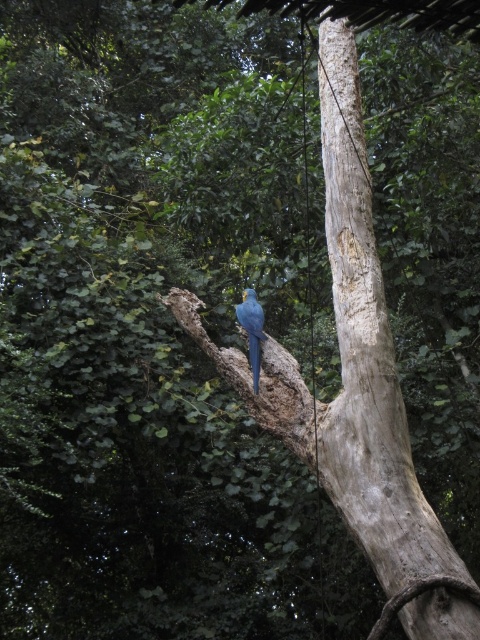
Question: Is smooth brown tree trunk at center further to camera compared to blue glossy parrot at center?

Choices:
 (A) no
 (B) yes

Answer: (A)

Question: Does smooth brown tree trunk at center lie behind blue glossy parrot at center?

Choices:
 (A) yes
 (B) no

Answer: (B)

Question: Among these objects, which one is farthest from the camera?

Choices:
 (A) blue glossy parrot at center
 (B) smooth brown tree trunk at center

Answer: (A)

Question: Is smooth brown tree trunk at center smaller than blue glossy parrot at center?

Choices:
 (A) yes
 (B) no

Answer: (B)

Question: Which point is closer to the camera taking this photo?

Choices:
 (A) (262, 310)
 (B) (339, 202)

Answer: (A)